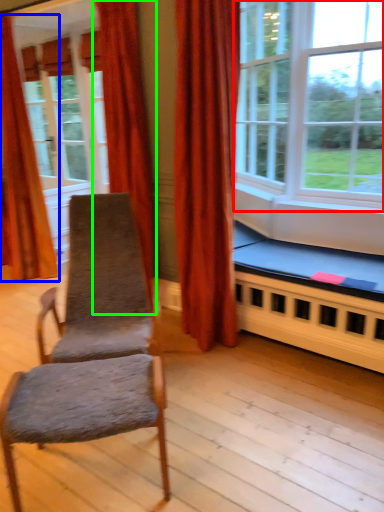
Question: Based on their relative distances, which object is nearer to window (highlighted by a red box)? Choose from curtain (highlighted by a blue box) and curtain (highlighted by a green box).

Choices:
 (A) curtain
 (B) curtain

Answer: (B)